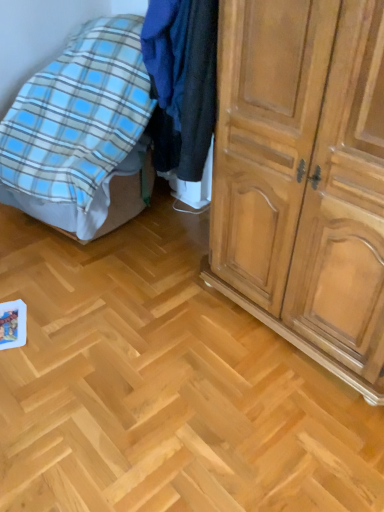
What are the coordinates of `vacant space that is in between light brown wooden cupboard at right and blue plaid blanket at left` in the screenshot? It's located at (186, 286).